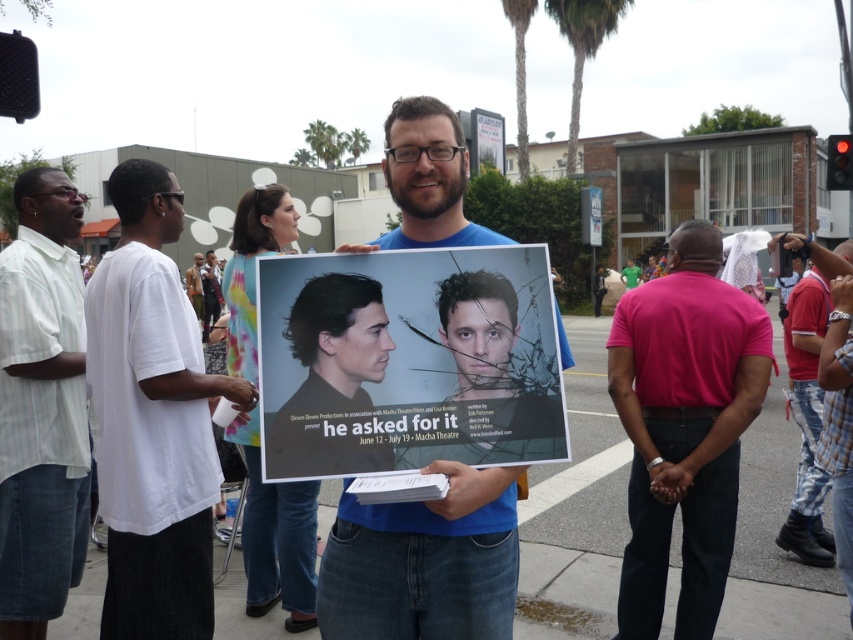
Can you confirm if pink cotton shirt at center is smaller than blue cotton shirt at center?

Actually, pink cotton shirt at center might be larger than blue cotton shirt at center.

Is point (730, 406) positioned in front of point (512, 488)?

No, it is behind (512, 488).

Find the location of a particular element. This screenshot has height=640, width=853. pink cotton shirt at center is located at coordinates (683, 428).

Does white striped shirt at left have a greater height compared to green fabric shirt at center?

Yes, white striped shirt at left is taller than green fabric shirt at center.

Image resolution: width=853 pixels, height=640 pixels. Describe the element at coordinates (41, 406) in the screenshot. I see `white striped shirt at left` at that location.

You are a GUI agent. You are given a task and a screenshot of the screen. Output one action in this format:
    pyautogui.click(x=<x>, y=<y>)
    Task: Click on the white striped shirt at left
    
    Given the screenshot: What is the action you would take?
    pyautogui.click(x=41, y=406)

Does blue cotton shirt at center have a larger size compared to green fabric shirt at center?

No.

Who is lower down, blue cotton shirt at center or green fabric shirt at center?

blue cotton shirt at center is lower down.

Describe the element at coordinates (426, 180) in the screenshot. I see `blue cotton shirt at center` at that location.

You are a GUI agent. You are given a task and a screenshot of the screen. Output one action in this format:
    pyautogui.click(x=<x>, y=<y>)
    Task: Click on the blue cotton shirt at center
    The height and width of the screenshot is (640, 853).
    Given the screenshot: What is the action you would take?
    pyautogui.click(x=426, y=180)